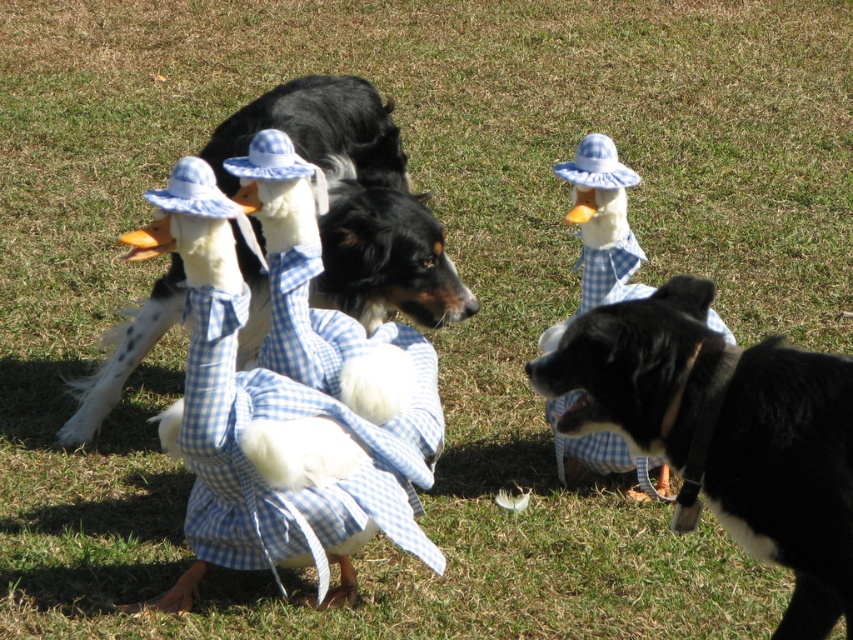
Question: Does black fur dog at center appear on the left side of blue gingham duck at center?

Choices:
 (A) yes
 (B) no

Answer: (B)

Question: Which of the following is the closest to the observer?

Choices:
 (A) black glossy dog at center
 (B) blue gingham duck at center
 (C) blue checkered dress at center
 (D) black fur dog at center

Answer: (D)

Question: Which object appears closest to the camera in this image?

Choices:
 (A) blue checkered dress at center
 (B) black glossy dog at center
 (C) black fur dog at center
 (D) blue gingham duck at center

Answer: (C)

Question: Is black glossy dog at center to the left of blue gingham duck at center from the viewer's perspective?

Choices:
 (A) yes
 (B) no

Answer: (A)

Question: Estimate the real-world distances between objects in this image. Which object is farther from the blue gingham duck at center?

Choices:
 (A) blue checkered dress at center
 (B) black glossy dog at center

Answer: (A)

Question: Is black fur dog at center positioned before blue gingham duck at center?

Choices:
 (A) no
 (B) yes

Answer: (B)